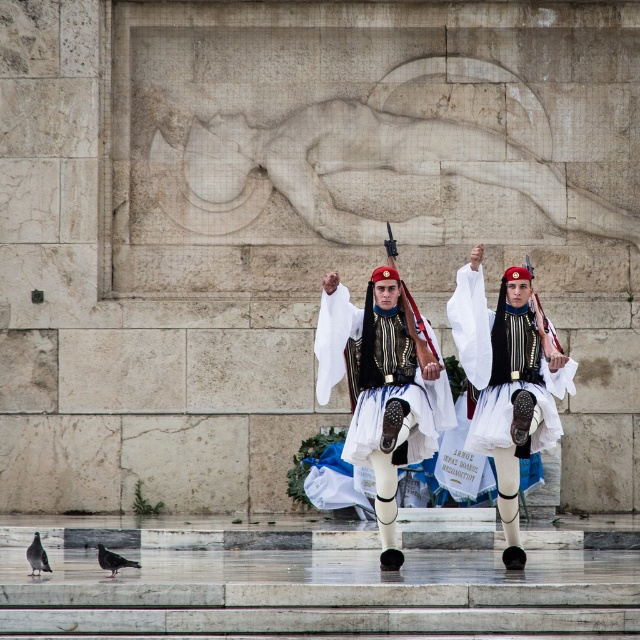
Question: Which object is positioned farthest from the white satin uniform at center?

Choices:
 (A) gray feathered pigeon at lower left
 (B) white cotton uniform at center

Answer: (A)

Question: Which of the following is the farthest from the observer?

Choices:
 (A) (x=45, y=557)
 (B) (x=541, y=380)

Answer: (B)

Question: Is white cotton uniform at center below gray feathered pigeon at lower left?

Choices:
 (A) no
 (B) yes

Answer: (A)

Question: Is white satin uniform at center above dark gray feathered pigeon at lower left?

Choices:
 (A) yes
 (B) no

Answer: (A)

Question: Is white satin uniform at center thinner than dark gray feathered pigeon at lower left?

Choices:
 (A) no
 (B) yes

Answer: (A)

Question: Which object is the farthest from the white cotton uniform at center?

Choices:
 (A) white satin uniform at center
 (B) dark gray feathered pigeon at lower left

Answer: (B)